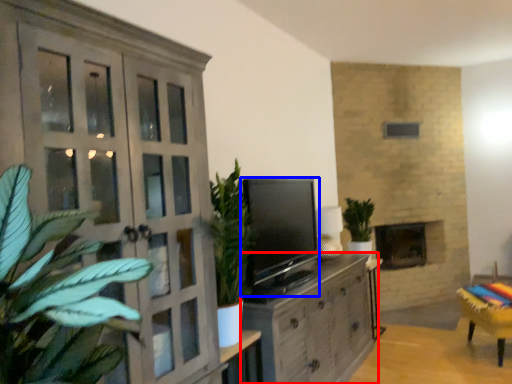
Question: Which point is further to the camera, cabinetry (highlighted by a red box) or level (highlighted by a blue box)?

Choices:
 (A) cabinetry
 (B) level

Answer: (B)